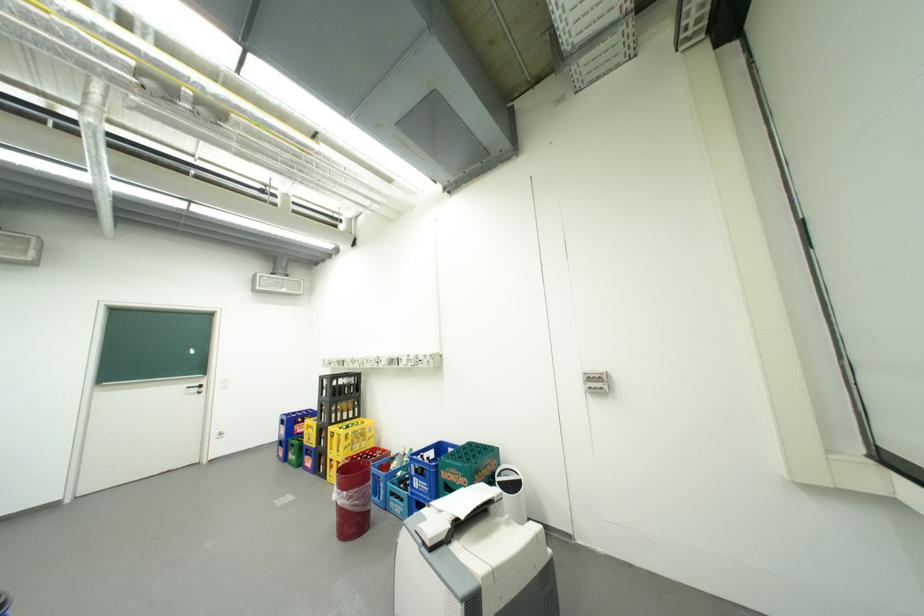
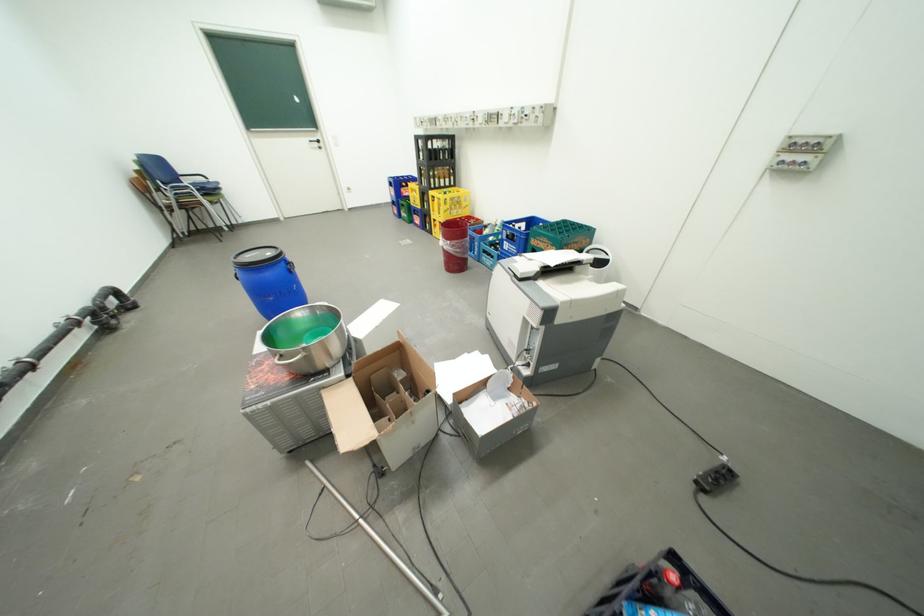
Find the pixel in the second image that matches pixel 424 480 in the first image.

(516, 244)